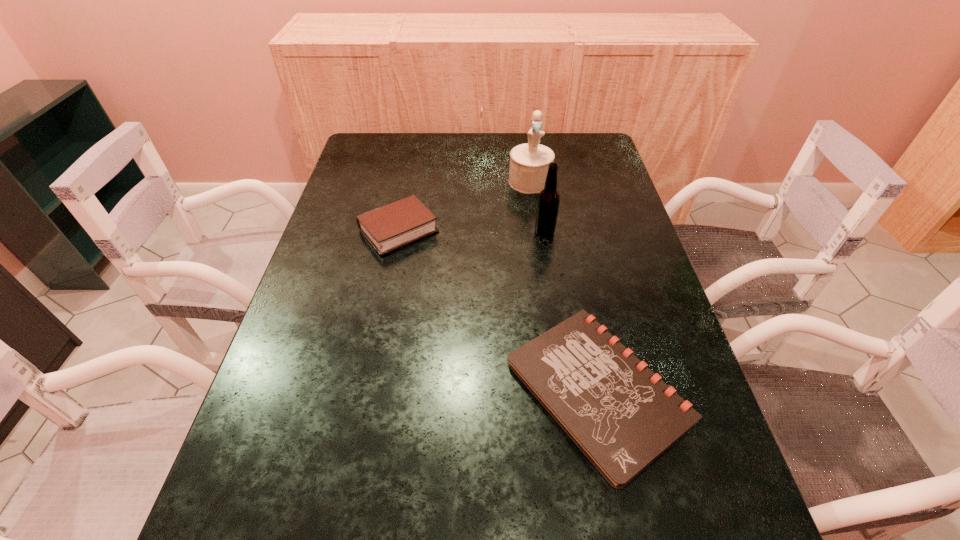
Where is `figurine`? figurine is located at coordinates [x=529, y=162].

Image resolution: width=960 pixels, height=540 pixels. Identify the location of beer bottle. (548, 202).

The height and width of the screenshot is (540, 960). I want to click on the third tallest object, so click(x=394, y=225).

Where is `the leftmost object`? The width and height of the screenshot is (960, 540). the leftmost object is located at coordinates (394, 225).

At what (x,y) coordinates should I click in order to perform the action: click on notebook. Please return your answer as a coordinate pair (x, y). This screenshot has height=540, width=960. Looking at the image, I should click on (620, 414).

Locate an element on the screen. the shortest object is located at coordinates (620, 414).

Find the location of a particular element. This screenshot has height=540, width=960. free space located 0.080m at the beak of the farthest object is located at coordinates (534, 210).

This screenshot has width=960, height=540. I want to click on vacant space located 0.390m on the back of the beer bottle, so click(532, 153).

What are the coordinates of `vacant space located 0.070m on the front of the third tallest object` in the screenshot? It's located at (390, 276).

In order to click on free space located 0.050m on the front of the shortest object in this screenshot , I will do `click(625, 523)`.